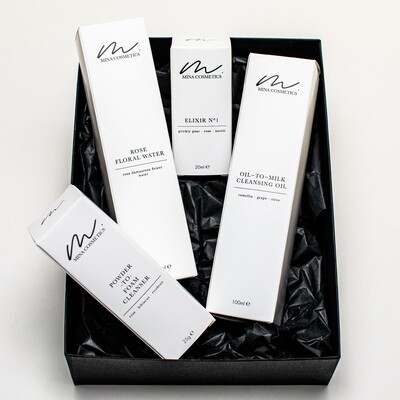
The height and width of the screenshot is (400, 400). Find the location of `box`. box is located at coordinates (279, 232).